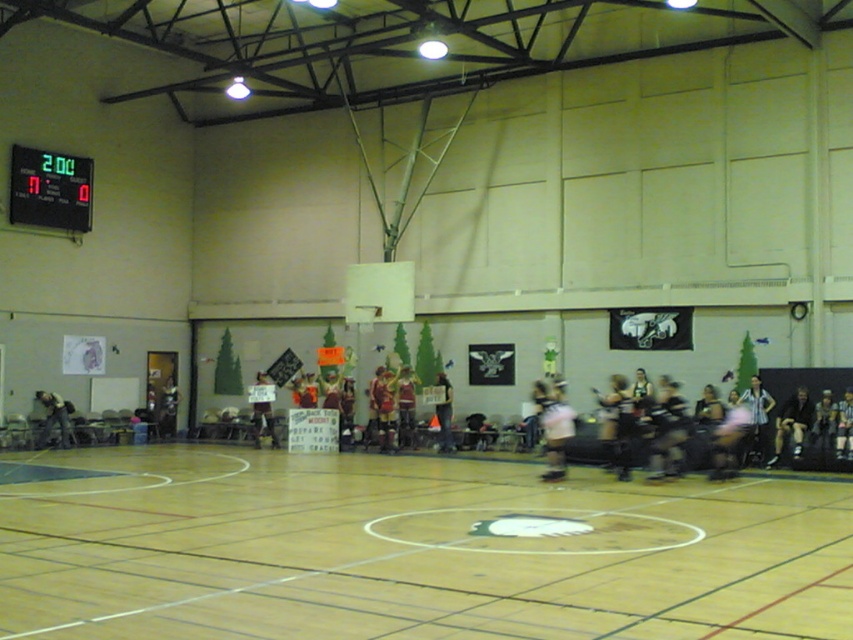
Based on the photo, you are a basketball player standing at the center of the court. You want to grab the pink fabric at center and the blue striped shirt at center. Which one is closer to you?

Both the pink fabric at center and the blue striped shirt at center are at the same distance from you since they are both at the center of the court.

You are a basketball player standing at the center of the court. You want to pass the ball to a teammate located at point (264, 406). However, there is an opponent player blocking your path at point (445, 413). Can you still make the pass without the opponent intercepting the ball?

Point (264, 406) is behind point (445, 413), so the opponent player at point (445, 413) is between you and your teammate. Therefore, the opponent can intercept the ball, making it difficult to pass safely.

You are a photographer positioned at the back of the gymnasium, aiming to capture a photo of both the white jersey at center and the matte red jersey at center. Since you want both to be clearly visible, which jersey should you focus on first to ensure proper focus, considering their sizes?

The white jersey at center is wider than the matte red jersey at center, so focusing on the white jersey at center first would ensure proper focus as it occupies more space in the frame.